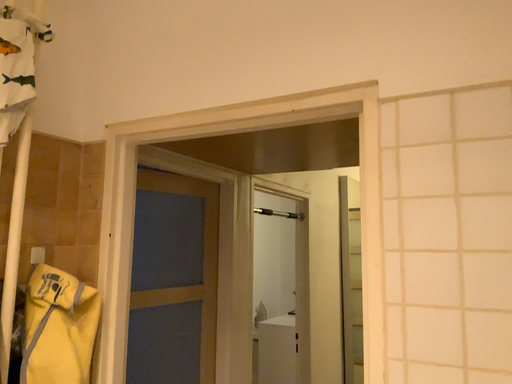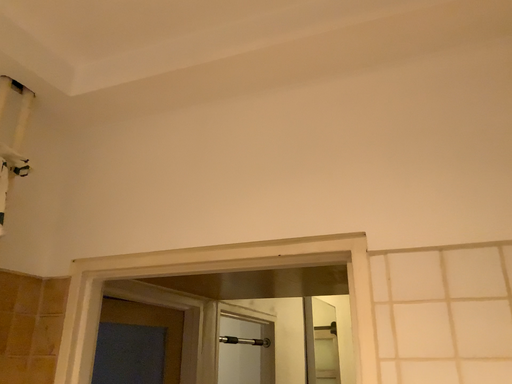
Question: How did the camera likely rotate when shooting the video?

Choices:
 (A) rotated downward
 (B) rotated upward

Answer: (B)